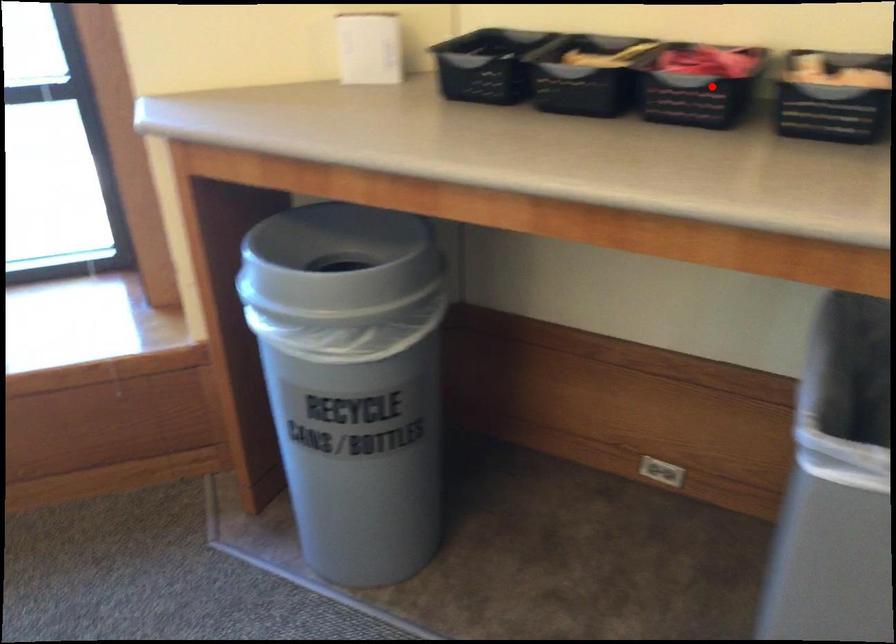
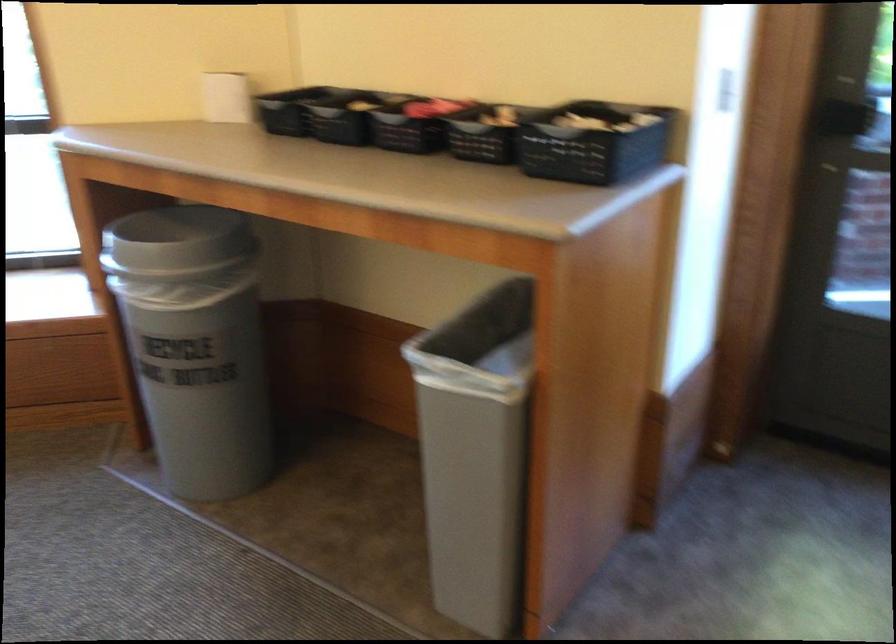
Question: I am providing you with two images of the same scene from different viewpoints. Image1 has a red point marked. In image2, the corresponding 3D location appears at what relative position? Reply with the corresponding letter.

Choices:
 (A) Closer
 (B) Farther

Answer: (B)